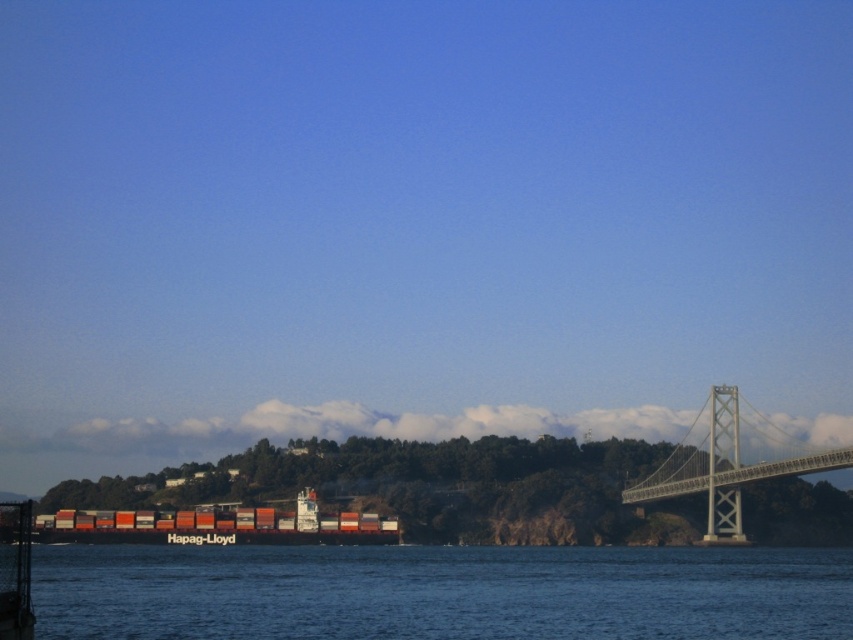
Question: Does blue water at lower center appear over gray metallic bridge at right?

Choices:
 (A) yes
 (B) no

Answer: (B)

Question: Which object appears farthest from the camera in this image?

Choices:
 (A) gray metallic bridge at right
 (B) orange matte container ship at center

Answer: (A)

Question: Among these points, which one is nearest to the camera?

Choices:
 (A) (59, 561)
 (B) (61, 515)

Answer: (A)

Question: Can you confirm if gray metallic bridge at right is positioned above orange matte container ship at center?

Choices:
 (A) yes
 (B) no

Answer: (B)

Question: Is gray metallic bridge at right wider than orange matte container ship at center?

Choices:
 (A) yes
 (B) no

Answer: (A)

Question: Which of the following is the farthest from the observer?

Choices:
 (A) orange matte container ship at center
 (B) blue water at lower center

Answer: (A)